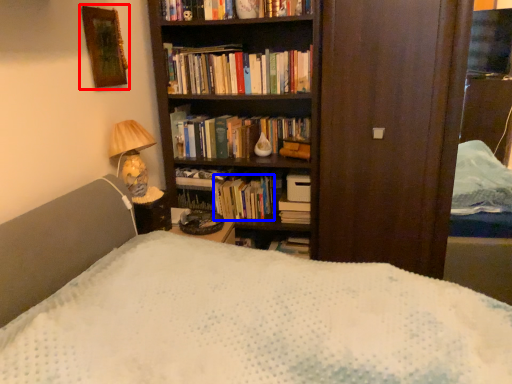
Question: Which object appears closest to the camera in this image, picture frame (highlighted by a red box) or book (highlighted by a blue box)?

Choices:
 (A) picture frame
 (B) book

Answer: (A)